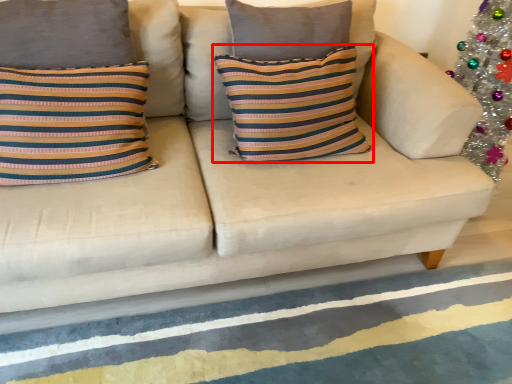
Question: Considering the relative positions of pillow (annotated by the red box) and stripe in the image provided, where is pillow (annotated by the red box) located with respect to the staircase?

Choices:
 (A) right
 (B) left

Answer: (B)